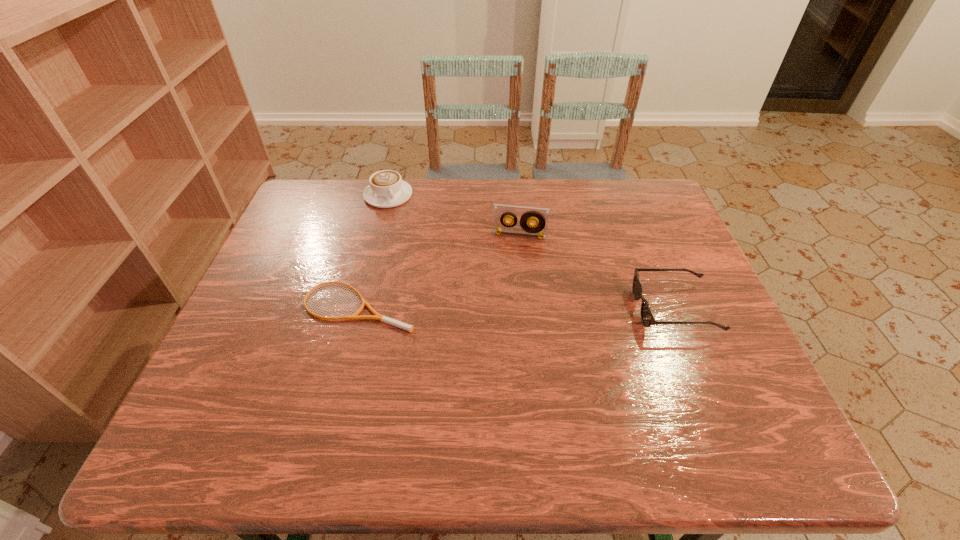
Where is `vacant space at the left edge of the desktop`? The width and height of the screenshot is (960, 540). vacant space at the left edge of the desktop is located at coordinates (274, 328).

I want to click on free space at the right edge of the desktop, so click(x=678, y=305).

The height and width of the screenshot is (540, 960). In order to click on free space at the far right corner of the desktop in this screenshot , I will do `click(639, 213)`.

Locate an element on the screen. This screenshot has height=540, width=960. free space at the near right corner of the desktop is located at coordinates (690, 376).

Identify the location of vacant space that is in between the tallest object and the rightmost object. (597, 272).

Image resolution: width=960 pixels, height=540 pixels. Identify the location of free area in between the farthest object and the sunglasses. (531, 252).

Locate an element on the screen. Image resolution: width=960 pixels, height=540 pixels. vacant area between the second farthest object and the shortest object is located at coordinates [439, 271].

The height and width of the screenshot is (540, 960). Find the location of `vacant region between the cappuccino and the tennis racket`. vacant region between the cappuccino and the tennis racket is located at coordinates (373, 250).

Image resolution: width=960 pixels, height=540 pixels. I want to click on free space between the second object from right to left and the shortest object, so click(439, 271).

Where is `free space that is in between the cappuccino and the shortest object`? The width and height of the screenshot is (960, 540). free space that is in between the cappuccino and the shortest object is located at coordinates (373, 250).